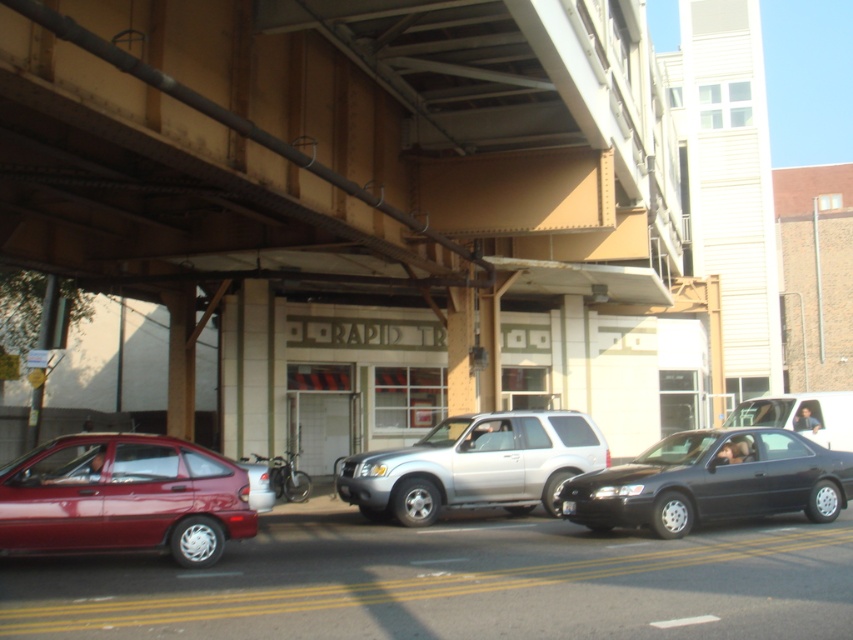
Is shiny maroon hatchback at left further to the viewer compared to matte silver suv at center?

No.

Can you confirm if shiny maroon hatchback at left is positioned to the right of matte silver suv at center?

No, shiny maroon hatchback at left is not to the right of matte silver suv at center.

Is point (59, 547) behind point (759, 412)?

No, it is not.

What are the coordinates of `shiny maroon hatchback at left` in the screenshot? It's located at (123, 497).

Which is behind, point (664, 504) or point (793, 403)?

Point (793, 403)

Can you confirm if shiny black sedan at center is smaller than matte silver suv at center?

Yes.

Is point (619, 470) positioned behind point (735, 417)?

No, it is not.

The width and height of the screenshot is (853, 640). Find the location of `shiny black sedan at center`. shiny black sedan at center is located at coordinates (712, 481).

Can you confirm if brown metal/steel overpass at center is positioned to the right of shiny black sedan at center?

Incorrect, brown metal/steel overpass at center is not on the right side of shiny black sedan at center.

Does brown metal/steel overpass at center have a smaller size compared to shiny black sedan at center?

Incorrect, brown metal/steel overpass at center is not smaller in size than shiny black sedan at center.

Who is more distant from viewer, (x=134, y=266) or (x=735, y=504)?

The point (x=134, y=266) is behind.

What are the coordinates of `brown metal/steel overpass at center` in the screenshot? It's located at coord(323,138).